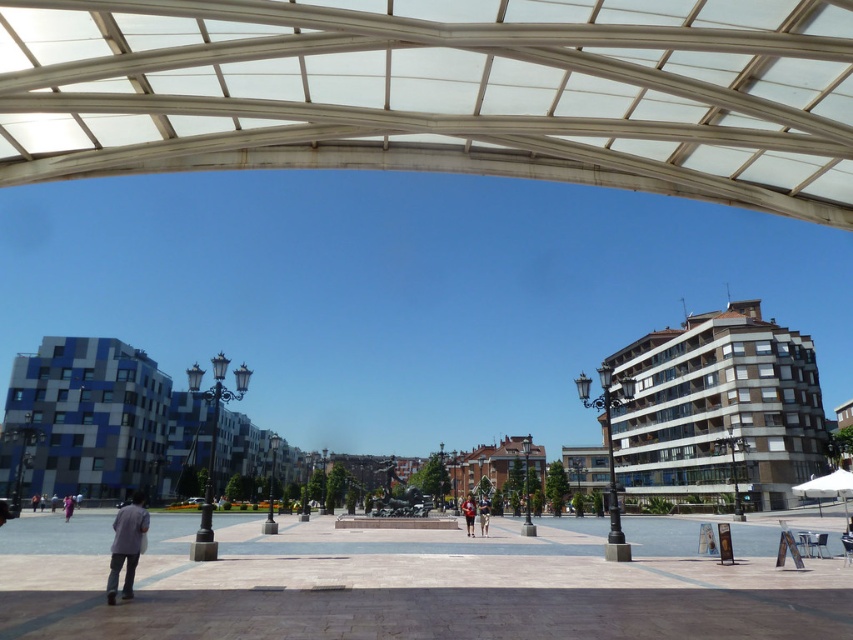
Question: Can you confirm if dark gray fabric jacket at lower left is positioned to the left of light brown leather jacket at center?

Choices:
 (A) no
 (B) yes

Answer: (B)

Question: Is matte gray jacket at center to the right of light blue denim jeans at lower left from the viewer's perspective?

Choices:
 (A) yes
 (B) no

Answer: (A)

Question: Among these objects, which one is nearest to the camera?

Choices:
 (A) white fabric canopy at lower right
 (B) dark gray fabric jacket at lower left
 (C) matte gray jacket at center
 (D) light blue denim jeans at lower left

Answer: (B)

Question: Which point is farther to the camera?

Choices:
 (A) white fabric canopy at lower right
 (B) light blue denim jeans at lower left
 (C) dark gray fabric jacket at lower left
 (D) light brown leather jacket at center

Answer: (B)

Question: Can you confirm if white fabric canopy at lower right is positioned below light blue denim jeans at lower left?

Choices:
 (A) yes
 (B) no

Answer: (B)

Question: Considering the real-world distances, which object is closest to the light brown leather jacket at center?

Choices:
 (A) light blue denim jeans at lower left
 (B) matte gray jacket at center
 (C) dark gray fabric jacket at lower left

Answer: (B)